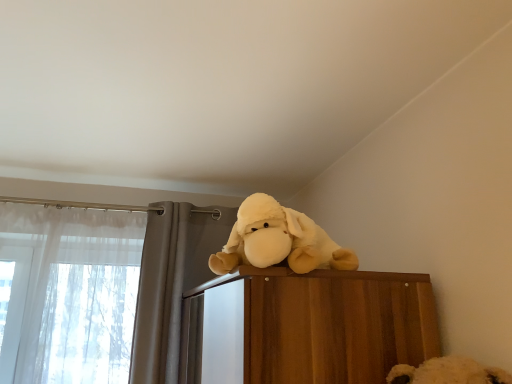
At what (x,y) coordinates should I click in order to perform the action: click on white plush toy at upper center. Please return your answer as a coordinate pair (x, y). Looking at the image, I should click on (278, 240).

The image size is (512, 384). Describe the element at coordinates (278, 240) in the screenshot. I see `white plush toy at upper center` at that location.

Where is `white plush toy at upper center`? white plush toy at upper center is located at coordinates (278, 240).